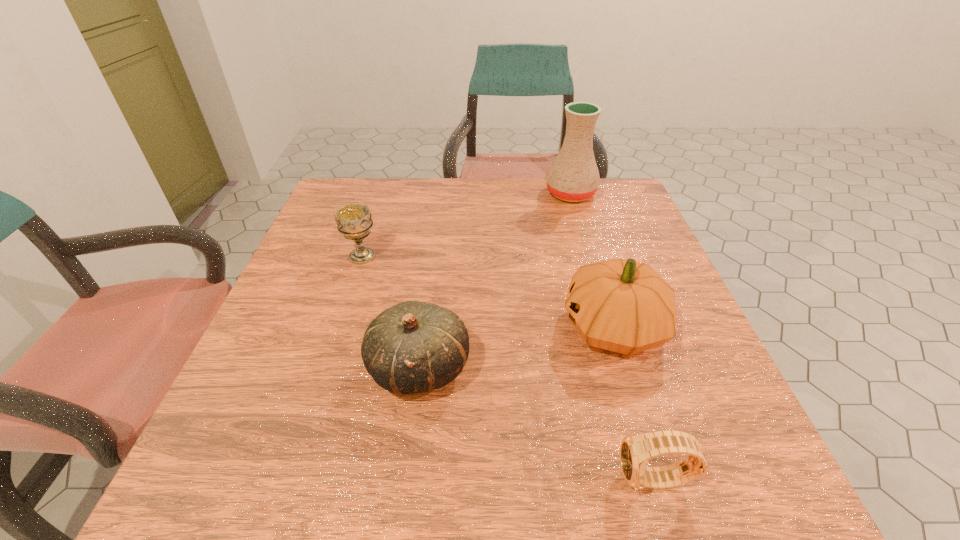
In order to click on object present at the near edge in this screenshot , I will do `click(636, 450)`.

Image resolution: width=960 pixels, height=540 pixels. I want to click on object at the left edge, so click(354, 221).

In order to click on pottery at the right edge in this screenshot , I will do `click(573, 176)`.

I want to click on gourd at the right edge, so click(624, 306).

In order to click on watch located in the right edge section of the desktop in this screenshot , I will do `click(636, 450)`.

Identify the location of object at the far right corner. This screenshot has width=960, height=540. (573, 176).

Image resolution: width=960 pixels, height=540 pixels. I want to click on object located in the near right corner section of the desktop, so click(636, 450).

At what (x,y) coordinates should I click in order to perform the action: click on vacant region at the far edge of the desktop. Please return your answer as a coordinate pair (x, y). Looking at the image, I should click on (405, 178).

Locate an element on the screen. free location at the near edge is located at coordinates (665, 509).

Find the location of a particular element. The height and width of the screenshot is (540, 960). vacant region at the left edge of the desktop is located at coordinates (294, 373).